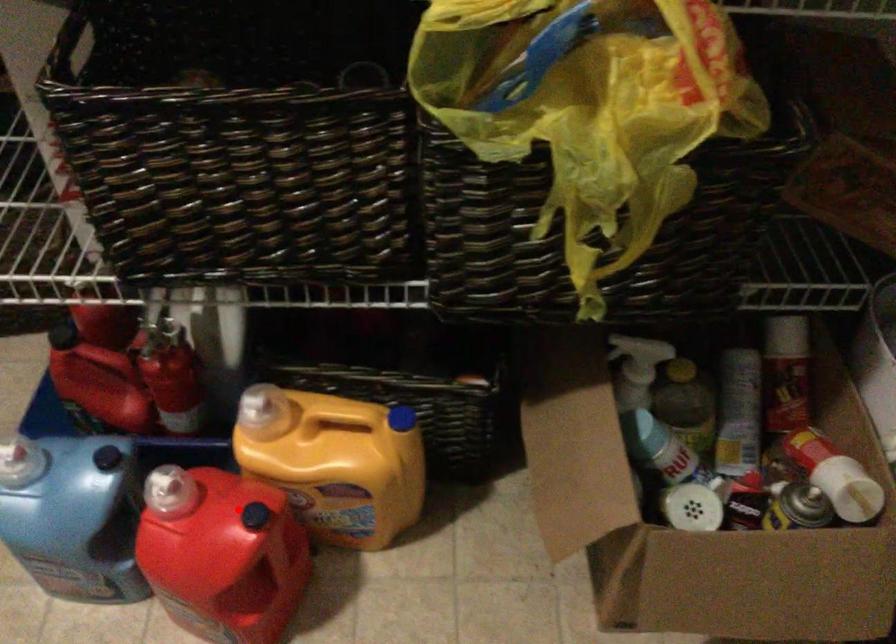
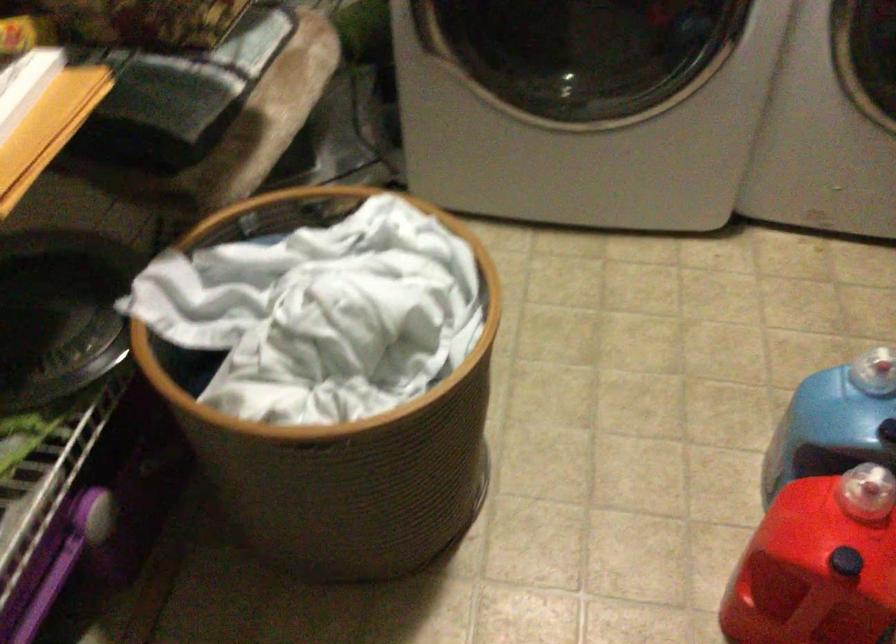
Locate, in the second image, the point that corresponds to the highlighted location in the first image.

(846, 562)